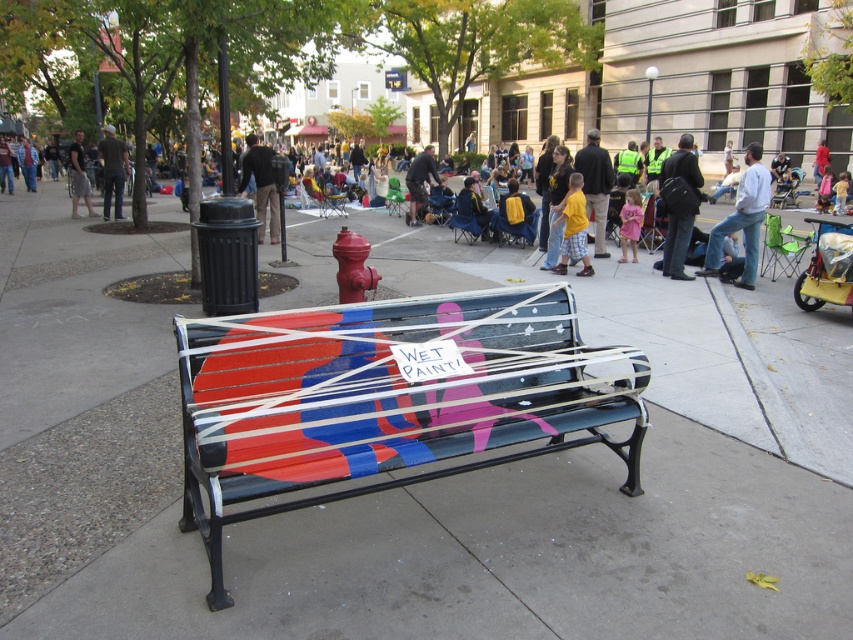
Question: Which of the following is the farthest from the observer?

Choices:
 (A) (625, 225)
 (B) (363, 240)
 (C) (82, 180)

Answer: (C)

Question: Is yellow shirt at center to the right of brushed metal shorts at center from the viewer's perspective?

Choices:
 (A) yes
 (B) no

Answer: (A)

Question: Does dark gray jacket at center appear under yellow shirt at center?

Choices:
 (A) yes
 (B) no

Answer: (A)

Question: Which object appears farthest from the camera in this image?

Choices:
 (A) light brown hair at center
 (B) dark brown pants at center
 (C) dark gray shirt at center
 (D) brushed metal shorts at center

Answer: (A)

Question: Which object is farther from the camera taking this photo?

Choices:
 (A) yellow cotton shirt at center
 (B) red fabric jacket at center
 (C) dark brown pants at center

Answer: (B)

Question: Is glossy painted bench at center positioned before dark gray jacket at center?

Choices:
 (A) yes
 (B) no

Answer: (A)